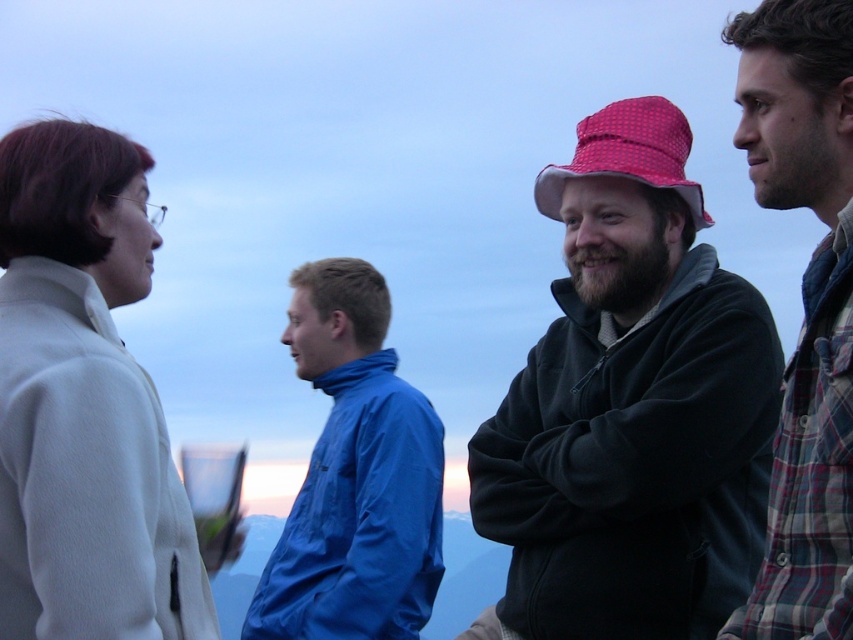
You are a photographer trying to capture a photo of the matte black jacket at center and the blue smooth jacket at center. Based on their positions, which jacket should you focus on first to ensure both are in frame?

The matte black jacket at center is below the blue smooth jacket at center, so you should focus on the blue smooth jacket at center first to ensure both are in frame.

You are a photographer trying to capture a photo of the blue smooth jacket at center and the red checkered fabric hat at center. Which object is closer to the camera?

The blue smooth jacket at center is closer to the camera because the red checkered fabric hat at center is behind it.